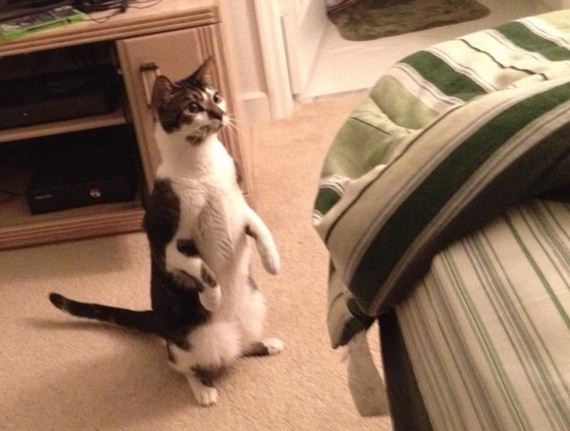
The image size is (570, 431). I want to click on cabinet door, so click(150, 63).